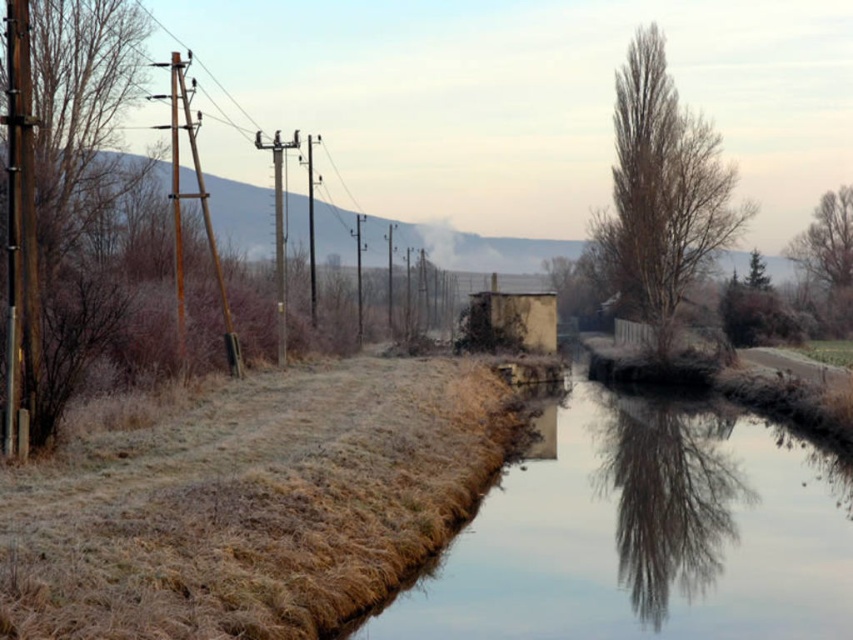
Question: Which object is farther from the camera taking this photo?

Choices:
 (A) brown textured tree at left
 (B) bare branches at upper right

Answer: (B)

Question: Can you confirm if brown textured tree at left is positioned below green leafy tree at upper right?

Choices:
 (A) no
 (B) yes

Answer: (A)

Question: Which object appears closest to the camera in this image?

Choices:
 (A) brown wooden pole at left
 (B) bare brown tree at upper right
 (C) bare branches at upper right
 (D) green leafy tree at upper right

Answer: (A)

Question: Can you confirm if brown wooden pole at left is positioned above bare branches at upper right?

Choices:
 (A) yes
 (B) no

Answer: (B)

Question: From the image, what is the correct spatial relationship of brown textured tree at left in relation to green leafy tree at upper right?

Choices:
 (A) below
 (B) above

Answer: (B)

Question: Estimate the real-world distances between objects in this image. Which object is farther from the bare brown tree at upper right?

Choices:
 (A) brown textured tree at left
 (B) green leafy tree at upper right
 (C) brown wooden pole at left
 (D) bare branches at upper right

Answer: (C)